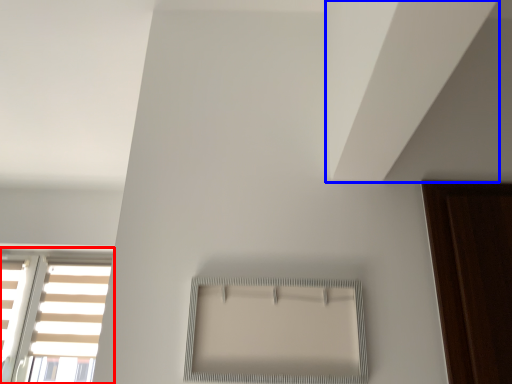
Question: Among these objects, which one is nearest to the camera, window (highlighted by a red box) or blind (highlighted by a blue box)?

Choices:
 (A) window
 (B) blind

Answer: (B)